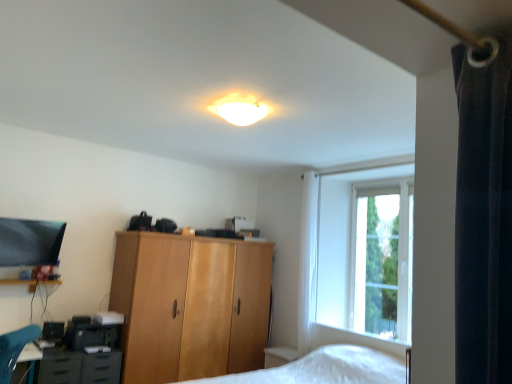
Question: Can you confirm if white fabric curtain at center is thinner than matte brown cabinet at lower left?

Choices:
 (A) yes
 (B) no

Answer: (A)

Question: Is white fabric curtain at center outside of matte brown cabinet at lower left?

Choices:
 (A) no
 (B) yes

Answer: (B)

Question: Is white fabric curtain at center shorter than matte brown cabinet at lower left?

Choices:
 (A) no
 (B) yes

Answer: (A)

Question: From the image's perspective, would you say white fabric curtain at center is positioned over matte brown cabinet at lower left?

Choices:
 (A) no
 (B) yes

Answer: (B)

Question: Are white fabric curtain at center and matte brown cabinet at lower left far apart?

Choices:
 (A) yes
 (B) no

Answer: (A)

Question: From their relative heights in the image, would you say matte white ceiling light at upper center is taller or shorter than wooden cabinet at center?

Choices:
 (A) tall
 (B) short

Answer: (B)

Question: From a real-world perspective, is matte white ceiling light at upper center positioned above or below wooden cabinet at center?

Choices:
 (A) below
 (B) above

Answer: (B)

Question: From the image's perspective, is matte white ceiling light at upper center positioned above or below wooden cabinet at center?

Choices:
 (A) above
 (B) below

Answer: (A)

Question: Considering the relative positions of matte white ceiling light at upper center and wooden cabinet at center in the image provided, is matte white ceiling light at upper center to the left or to the right of wooden cabinet at center?

Choices:
 (A) left
 (B) right

Answer: (B)

Question: From a real-world perspective, is matte black drawer at lower left physically located above or below matte white ceiling light at upper center?

Choices:
 (A) above
 (B) below

Answer: (B)

Question: In terms of height, does matte black drawer at lower left look taller or shorter compared to matte white ceiling light at upper center?

Choices:
 (A) short
 (B) tall

Answer: (B)

Question: Is matte black drawer at lower left inside the boundaries of matte white ceiling light at upper center, or outside?

Choices:
 (A) outside
 (B) inside

Answer: (A)

Question: Is matte black drawer at lower left in front of or behind matte white ceiling light at upper center in the image?

Choices:
 (A) front
 (B) behind

Answer: (B)

Question: From a real-world perspective, is wooden cabinet at center above or below matte black drawer at lower left?

Choices:
 (A) below
 (B) above

Answer: (B)

Question: Is point (135, 281) positioned closer to the camera than point (51, 367)?

Choices:
 (A) closer
 (B) farther

Answer: (B)